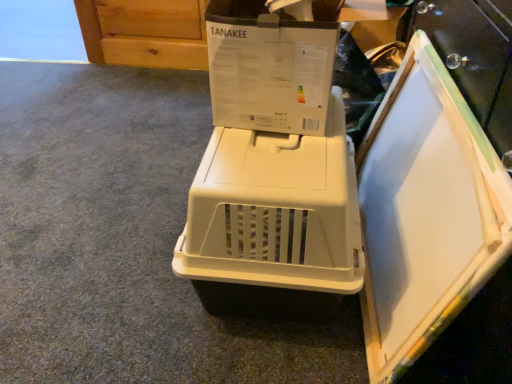
Question: Is white plastic board at right inside beige plastic pet carrier at center?

Choices:
 (A) yes
 (B) no

Answer: (B)

Question: Is there a large distance between beige plastic pet carrier at center and white plastic board at right?

Choices:
 (A) no
 (B) yes

Answer: (A)

Question: Is beige plastic pet carrier at center directly adjacent to white plastic board at right?

Choices:
 (A) yes
 (B) no

Answer: (B)

Question: From the image's perspective, is beige plastic pet carrier at center beneath white plastic board at right?

Choices:
 (A) yes
 (B) no

Answer: (A)

Question: Is beige plastic pet carrier at center taller than white plastic board at right?

Choices:
 (A) no
 (B) yes

Answer: (A)

Question: Considering the relative sizes of beige plastic pet carrier at center and white plastic board at right in the image provided, is beige plastic pet carrier at center smaller than white plastic board at right?

Choices:
 (A) yes
 (B) no

Answer: (B)

Question: Considering the relative sizes of white plastic board at right and beige plastic pet carrier at center in the image provided, is white plastic board at right bigger than beige plastic pet carrier at center?

Choices:
 (A) yes
 (B) no

Answer: (B)

Question: Does white plastic board at right have a smaller size compared to beige plastic pet carrier at center?

Choices:
 (A) no
 (B) yes

Answer: (B)

Question: Is the depth of white plastic board at right greater than that of beige plastic pet carrier at center?

Choices:
 (A) no
 (B) yes

Answer: (A)

Question: Considering the relative sizes of white plastic board at right and beige plastic pet carrier at center in the image provided, is white plastic board at right taller than beige plastic pet carrier at center?

Choices:
 (A) no
 (B) yes

Answer: (B)

Question: From a real-world perspective, is white plastic board at right over beige plastic pet carrier at center?

Choices:
 (A) no
 (B) yes

Answer: (B)

Question: Is white plastic board at right outside of beige plastic pet carrier at center?

Choices:
 (A) no
 (B) yes

Answer: (B)

Question: Is white plastic board at right to the left or to the right of beige plastic pet carrier at center in the image?

Choices:
 (A) left
 (B) right

Answer: (B)